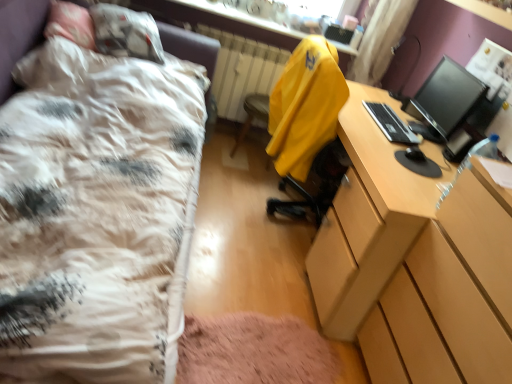
The height and width of the screenshot is (384, 512). I want to click on empty space that is ontop of white striped radiator at center (from a real-world perspective), so click(x=238, y=29).